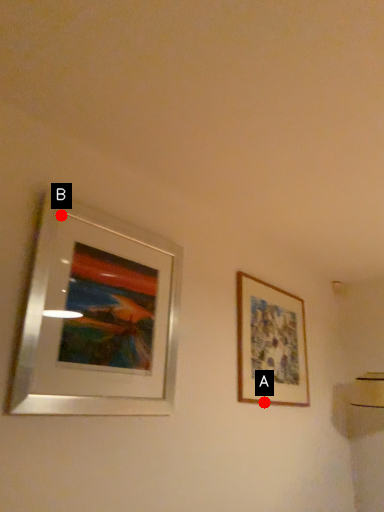
Question: Two points are circled on the image, labeled by A and B beside each circle. Which point is closer to the camera?

Choices:
 (A) A is closer
 (B) B is closer

Answer: (B)